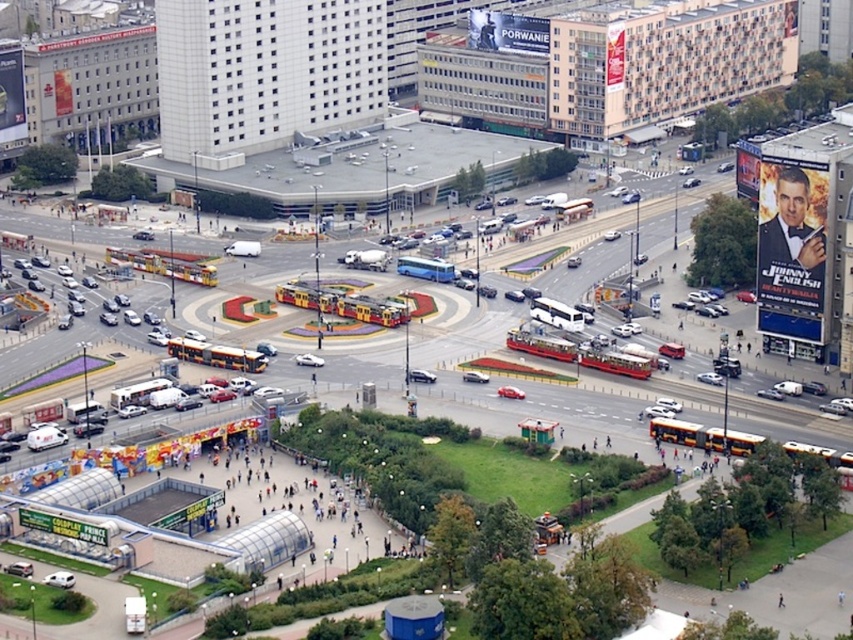
Between point (816, 166) and point (479, 12), which one is positioned behind?

Positioned behind is point (479, 12).

Can you confirm if metallic silver billboard at upper right is positioned below metallic silver billboard at upper center?

Indeed, metallic silver billboard at upper right is positioned under metallic silver billboard at upper center.

Describe the element at coordinates (791, 248) in the screenshot. The height and width of the screenshot is (640, 853). I see `metallic silver billboard at upper right` at that location.

Locate an element on the screen. The height and width of the screenshot is (640, 853). metallic silver billboard at upper right is located at coordinates (791, 248).

Between metallic silver billboard at upper center and metallic silver billboard at upper left, which one appears on the left side from the viewer's perspective?

metallic silver billboard at upper left is more to the left.

Where is `metallic silver billboard at upper center`? The image size is (853, 640). metallic silver billboard at upper center is located at coordinates (508, 33).

What do you see at coordinates (791, 248) in the screenshot? I see `metallic silver billboard at upper right` at bounding box center [791, 248].

Who is taller, metallic silver billboard at upper right or white glossy billboard at upper right?

Standing taller between the two is metallic silver billboard at upper right.

The image size is (853, 640). I want to click on metallic silver billboard at upper right, so click(791, 248).

Identify the location of metallic silver billboard at upper right. The height and width of the screenshot is (640, 853). (791, 248).